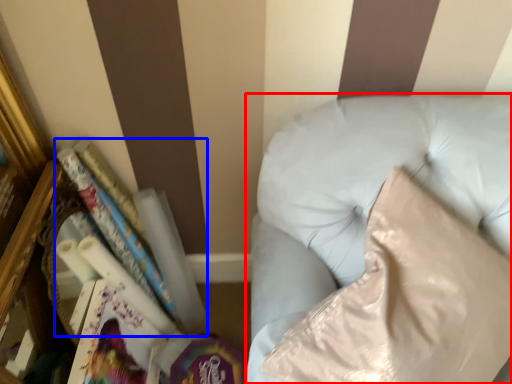
Question: Which of the following is the closest to the observer, furniture (highlighted by a red box) or book (highlighted by a blue box)?

Choices:
 (A) furniture
 (B) book

Answer: (A)